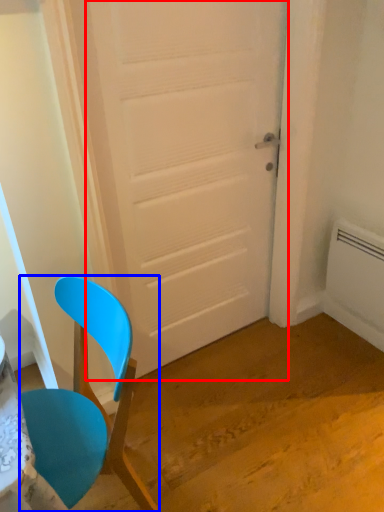
Question: Which object appears closest to the camera in this image, door (highlighted by a red box) or chair (highlighted by a blue box)?

Choices:
 (A) door
 (B) chair

Answer: (B)